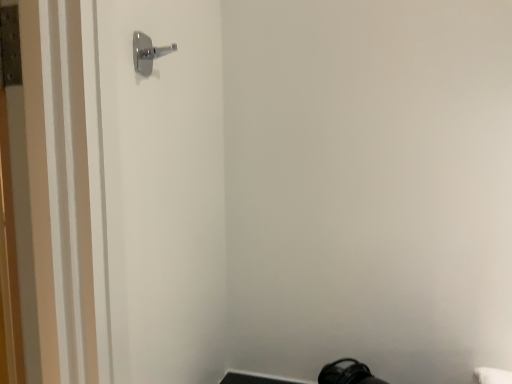
This screenshot has width=512, height=384. What do you see at coordinates (147, 53) in the screenshot?
I see `polished metal door handle at upper left` at bounding box center [147, 53].

The width and height of the screenshot is (512, 384). What are the coordinates of `polished metal door handle at upper left` in the screenshot? It's located at (147, 53).

Locate an element on the screen. The width and height of the screenshot is (512, 384). polished metal door handle at upper left is located at coordinates pyautogui.click(x=147, y=53).